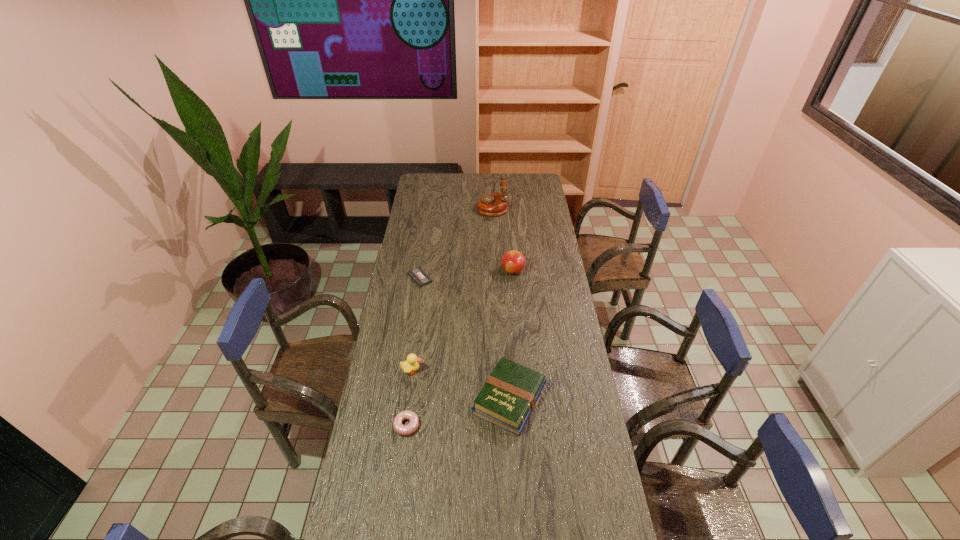
At what (x,y) coordinates should I click in order to perform the action: click on vacant point located between the telephone and the fourth tallest object. Please return your answer as a coordinate pair (x, y). This screenshot has width=960, height=540. Looking at the image, I should click on (501, 302).

Identify the location of unoccupied position between the tallest object and the duckling. (452, 288).

Where is `vacant area that lies between the videotape and the second shortest object`? vacant area that lies between the videotape and the second shortest object is located at coordinates (413, 352).

Find the location of `blank region between the fifth tallest object and the tallest object`. blank region between the fifth tallest object and the tallest object is located at coordinates (449, 316).

The image size is (960, 540). What are the coordinates of `object that stands as the closest to the tallest object` in the screenshot? It's located at (513, 262).

Find the location of `object that is the third closest one to the videotape`. object that is the third closest one to the videotape is located at coordinates pos(495,204).

The image size is (960, 540). I want to click on free space that satisfies the following two spatial constraints: 1. on the front-facing side of the duckling; 2. on the right side of the book, so click(408, 399).

Find the location of a particular element. This screenshot has width=960, height=540. vacant region that satisfies the following two spatial constraints: 1. on the dial of the telephone; 2. on the front side of the doughnut is located at coordinates (501, 426).

Locate an element on the screen. The height and width of the screenshot is (540, 960). vacant region that satisfies the following two spatial constraints: 1. on the front-facing side of the second shortest object; 2. on the left side of the duckling is located at coordinates (404, 426).